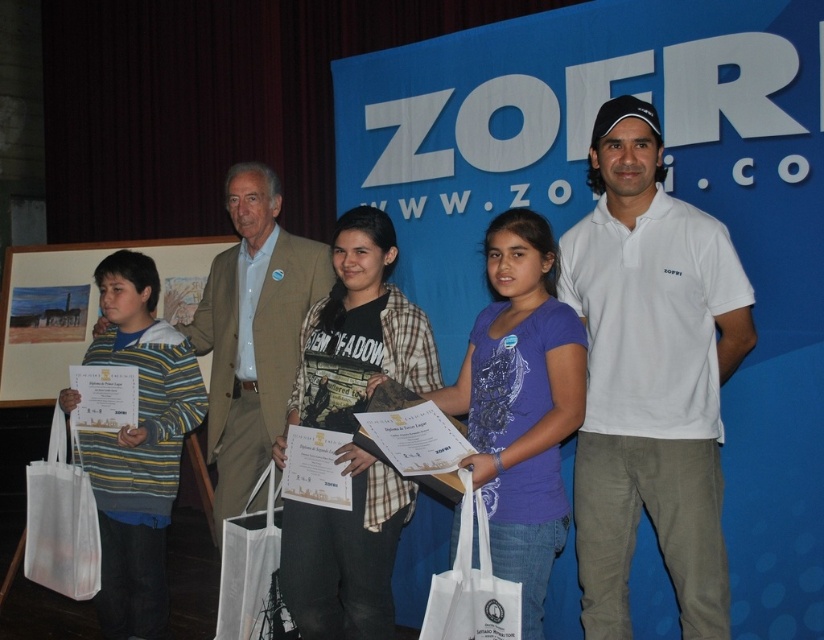
Based on the scene description, which object has a larger size between the matte white shirt at center and the striped cotton shirt at left?

The matte white shirt at center has a larger size compared to the striped cotton shirt at left.

You are organizing a photo shoot and need to position a spotlight on the matte white shirt at center. According to the coordinates provided, where should you place the spotlight relative to the image frame?

The matte white shirt at center is located at point coordinates (x=649, y=378), so the spotlight should be positioned at those coordinates to directly illuminate it.

You are a photographer who needs to adjust the lighting between the white cotton polo shirt at center and the wooden framed picture at left. The minimum distance required for proper lighting is 8 feet. Can you achieve the desired lighting setup between these two objects?

The white cotton polo shirt at center is 8.69 feet from the wooden framed picture at left, which exceeds the minimum required distance of 8 feet. Therefore, you can achieve the desired lighting setup between these two objects.